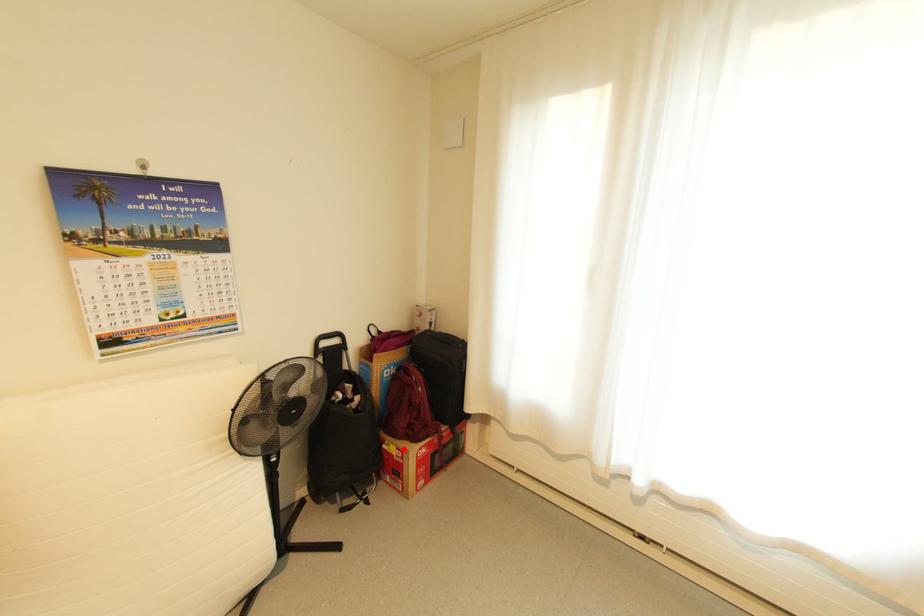
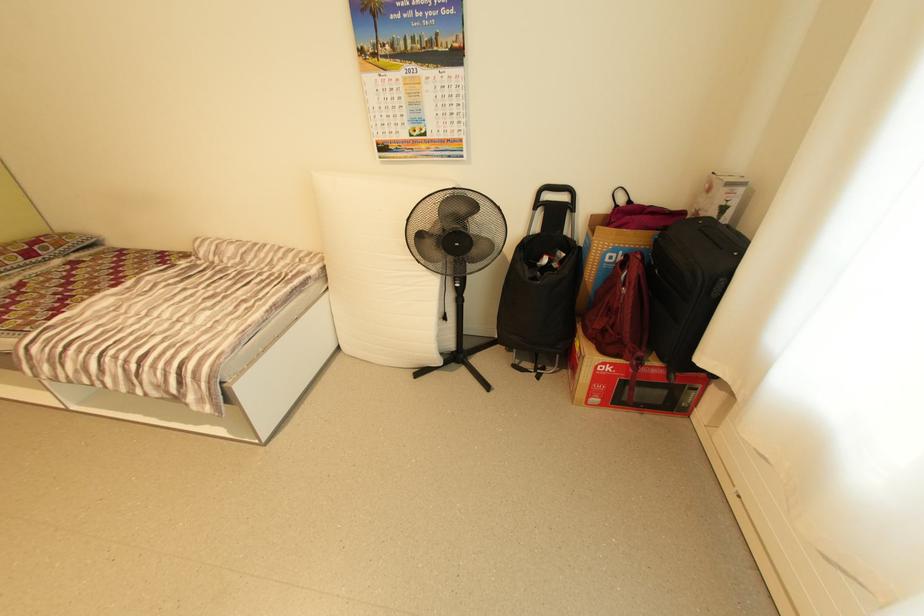
The point at the highlighted location is marked in the first image. Where is the corresponding point in the second image?

(586, 347)